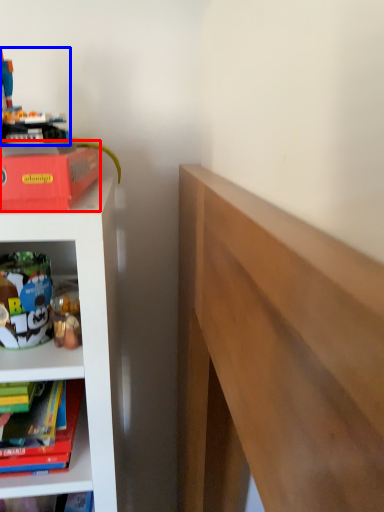
Question: Which object is further to the camera taking this photo, paperback book (highlighted by a red box) or toy (highlighted by a blue box)?

Choices:
 (A) paperback book
 (B) toy

Answer: (B)